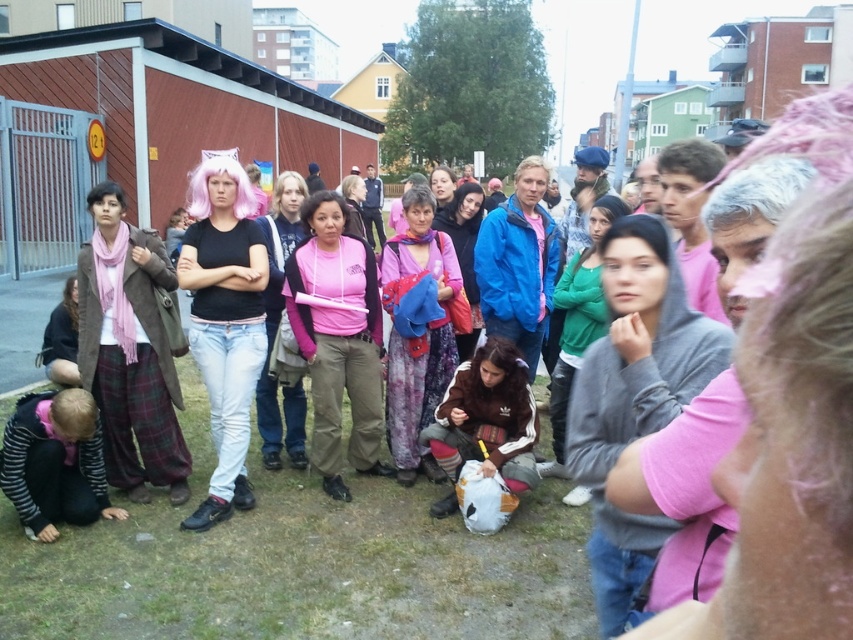
How far apart are matte black shirt at center and pink fabric jacket at center?

matte black shirt at center is 18.16 inches away from pink fabric jacket at center.

Can you confirm if matte black shirt at center is wider than pink fabric jacket at center?

Correct, the width of matte black shirt at center exceeds that of pink fabric jacket at center.

Between point (238, 349) and point (293, 426), which one is positioned in front?

Positioned in front is point (238, 349).

Where is `matte black shirt at center`? matte black shirt at center is located at coordinates (224, 321).

Is the position of brown fleece jacket at center less distant than that of gray matte jacket at center?

Yes, brown fleece jacket at center is closer to the viewer.

Can you confirm if brown fleece jacket at center is smaller than gray matte jacket at center?

Yes, brown fleece jacket at center is smaller than gray matte jacket at center.

Identify the location of brown fleece jacket at center. (486, 417).

Who is more distant from viewer, (x=149, y=292) or (x=462, y=198)?

Point (x=462, y=198)

I want to click on pink scarf at center, so click(x=129, y=352).

This screenshot has height=640, width=853. I want to click on pink scarf at center, so click(x=129, y=352).